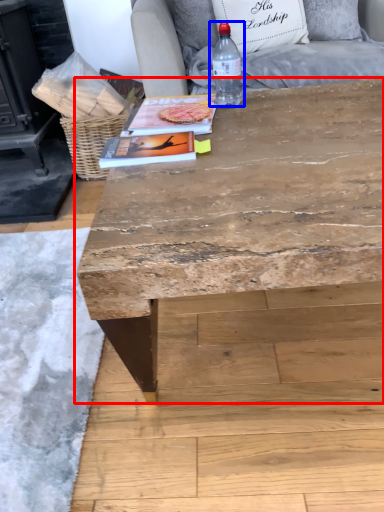
Question: Which point is further to the camera, table (highlighted by a red box) or bottle (highlighted by a blue box)?

Choices:
 (A) table
 (B) bottle

Answer: (B)